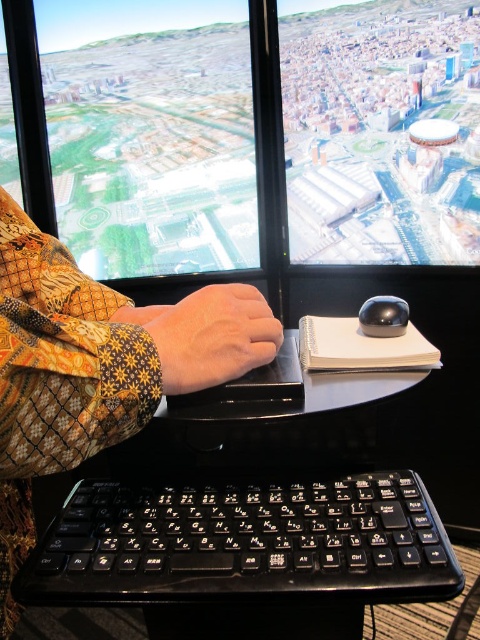
You are organizing a desk and need to place a new lamp. The lamp requires a surface that is above the black plastic keyboard at lower center. Is the black plastic table at center a suitable surface for placing the lamp?

Yes, the black plastic table at center is located above the black plastic keyboard at lower center, so it is a suitable surface for placing the lamp.

You are organizing a desk and need to place both the black plastic table at center and the satin black mouse at center. Based on the scene description, which object has a greater width?

The black plastic table at center has a greater width than the satin black mouse at center according to the description.